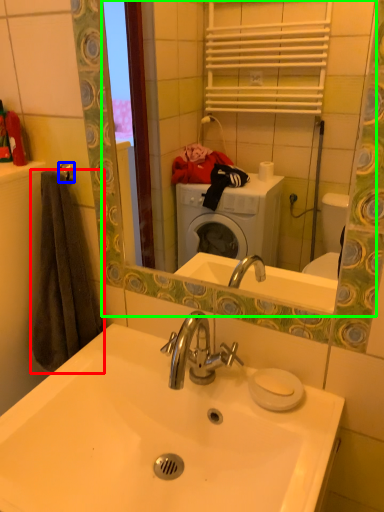
Question: Which is farther away from bath towel (highlighted by a red box)? towel bar (highlighted by a blue box) or mirror (highlighted by a green box)?

Choices:
 (A) towel bar
 (B) mirror

Answer: (B)